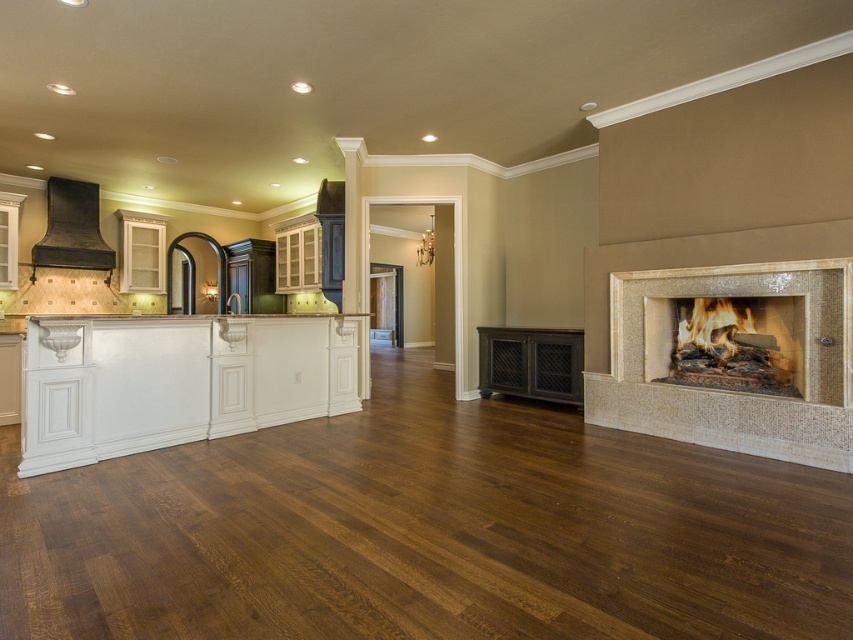
Based on the photo, can you confirm if beige mosaic tile fireplace at right is positioned above matte stone fireplace at right?

Actually, beige mosaic tile fireplace at right is below matte stone fireplace at right.

Is point (850, 376) positioned in front of point (749, 380)?

Yes.

Where is `beige mosaic tile fireplace at right`? This screenshot has height=640, width=853. beige mosaic tile fireplace at right is located at coordinates (724, 390).

Does beige mosaic tile fireplace at right have a lesser height compared to matte black range hood at upper left?

In fact, beige mosaic tile fireplace at right may be taller than matte black range hood at upper left.

Does beige mosaic tile fireplace at right appear on the left side of matte black range hood at upper left?

In fact, beige mosaic tile fireplace at right is to the right of matte black range hood at upper left.

Where is `beige mosaic tile fireplace at right`? The image size is (853, 640). beige mosaic tile fireplace at right is located at coordinates (724, 390).

Between matte stone fireplace at right and matte black range hood at upper left, which one has less height?

matte stone fireplace at right is shorter.

Is matte stone fireplace at right below matte black range hood at upper left?

Yes, matte stone fireplace at right is below matte black range hood at upper left.

I want to click on matte stone fireplace at right, so click(x=726, y=342).